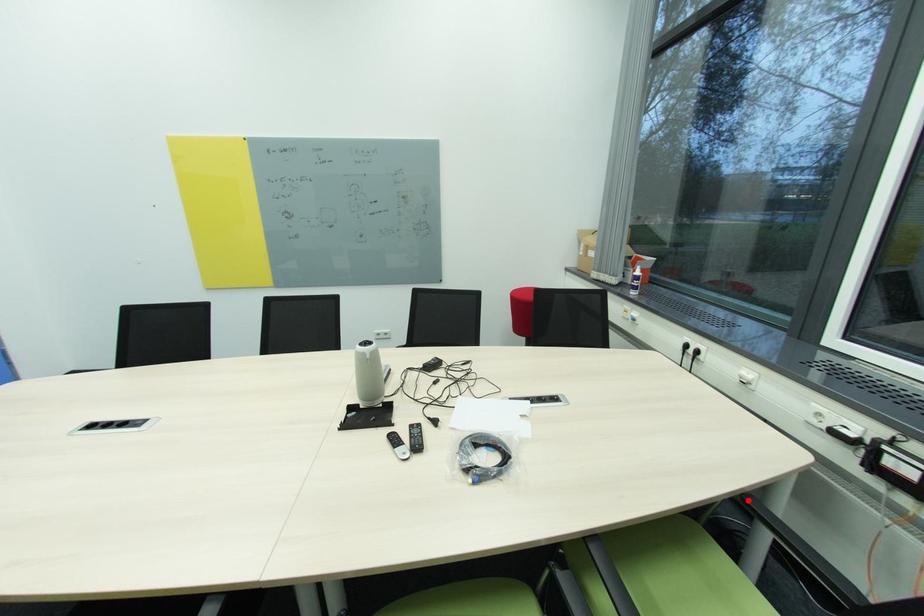
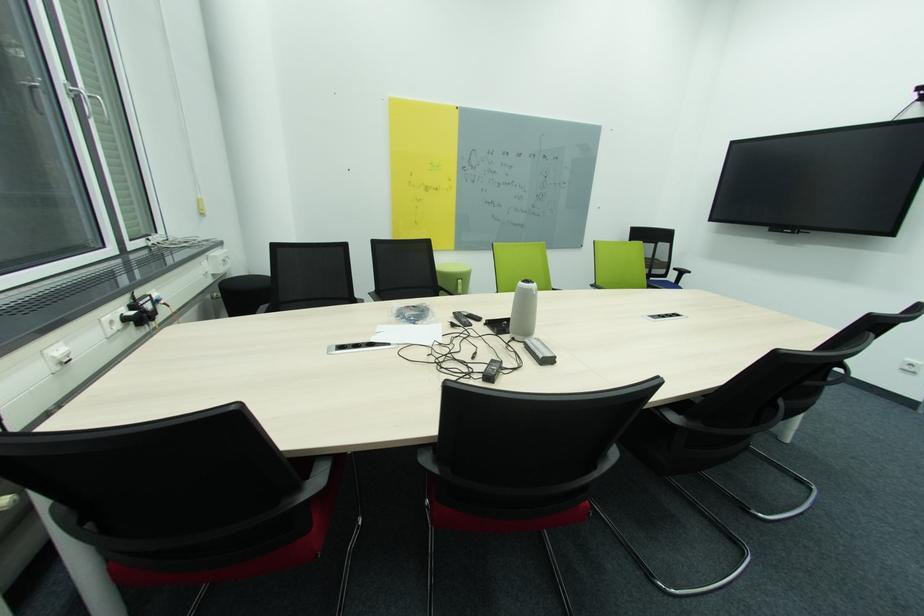
Question: I am providing you with two images of the same scene from different viewpoints. A red point is marked on the first image. Can you still see the location of the red point in image 2?

Choices:
 (A) Yes
 (B) No

Answer: (B)